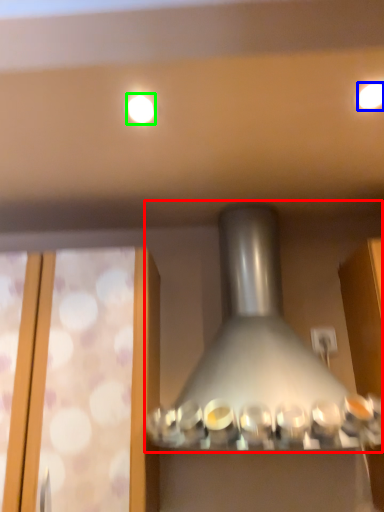
Question: Based on their relative distances, which object is nearer to lamp (highlighted by a red box)? Choose from lighting (highlighted by a blue box) and lighting (highlighted by a green box).

Choices:
 (A) lighting
 (B) lighting

Answer: (B)